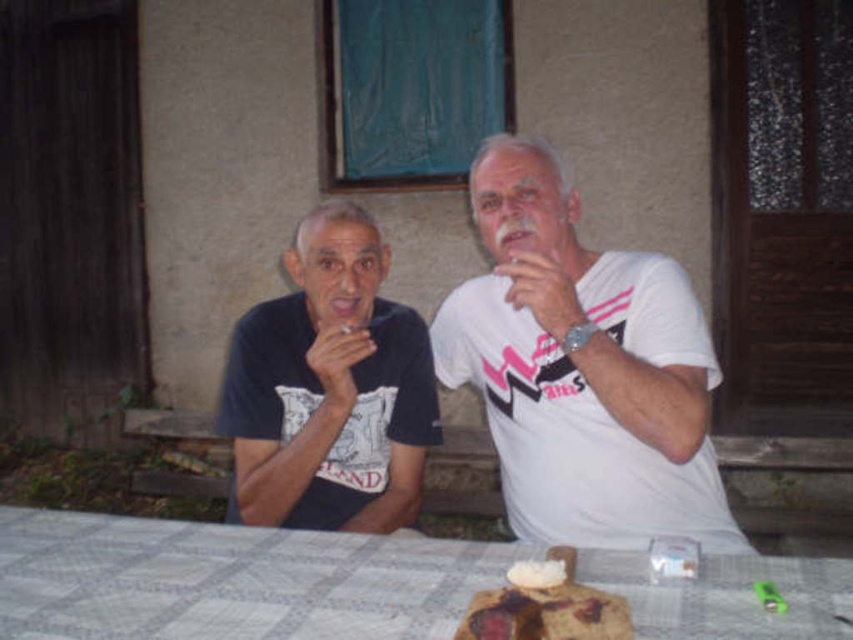
Question: Is white matte t-shirt at center bigger than white crumbly cake at center?

Choices:
 (A) no
 (B) yes

Answer: (B)

Question: Is white fabric table at center to the right of white crumbly cake at center from the viewer's perspective?

Choices:
 (A) no
 (B) yes

Answer: (A)

Question: Is white matte t-shirt at center to the left of white crumbly cake at center from the viewer's perspective?

Choices:
 (A) no
 (B) yes

Answer: (A)

Question: Among these points, which one is farthest from the camera?

Choices:
 (A) (590, 305)
 (B) (624, 627)
 (C) (364, 337)

Answer: (A)

Question: Which point appears farthest from the camera in this image?

Choices:
 (A) (476, 374)
 (B) (453, 598)

Answer: (A)

Question: Which object is the closest to the black matte t-shirt at center?

Choices:
 (A) white crumbly cake at center
 (B) white fabric table at center
 (C) white matte t-shirt at center

Answer: (C)